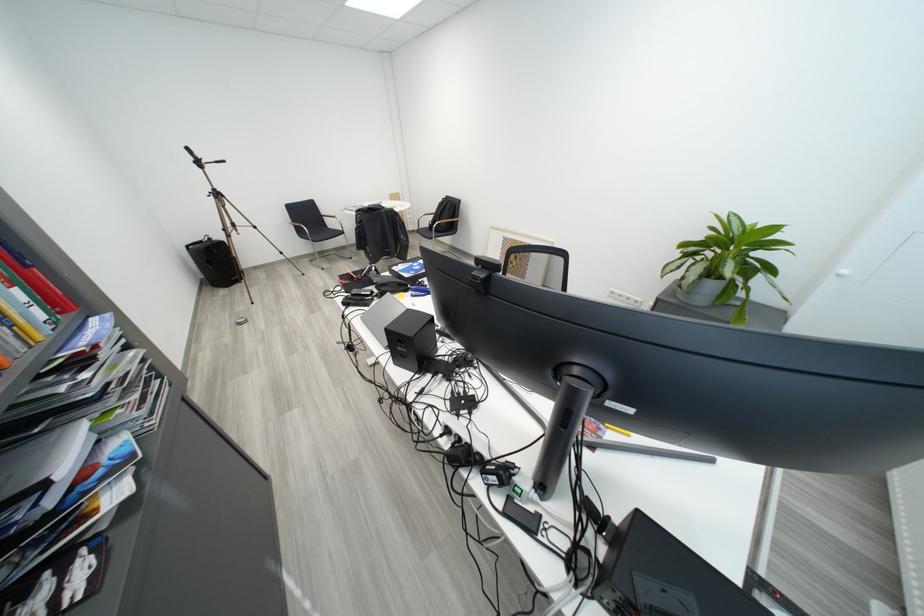
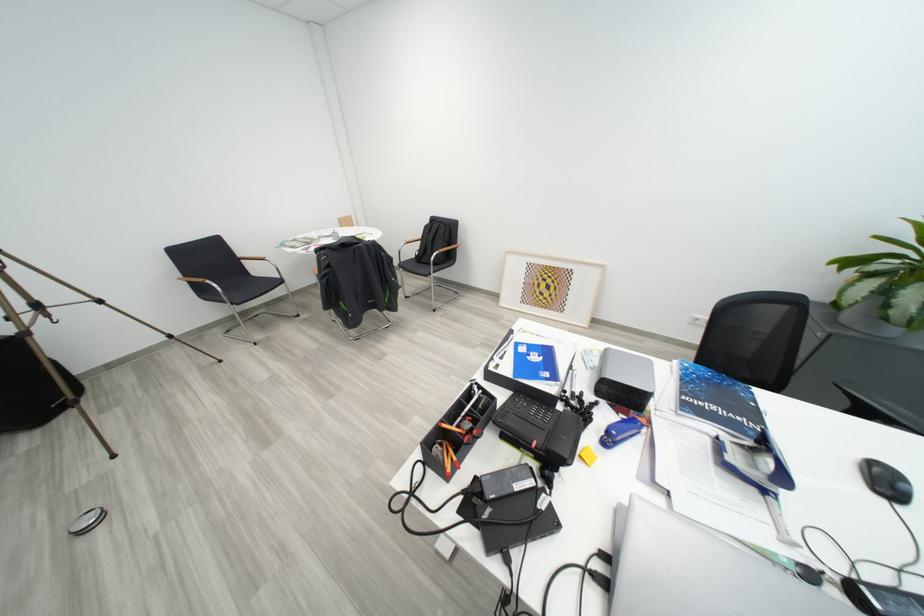
Where in the second image is the point corresponding to (x=419, y=294) from the first image?

(600, 438)